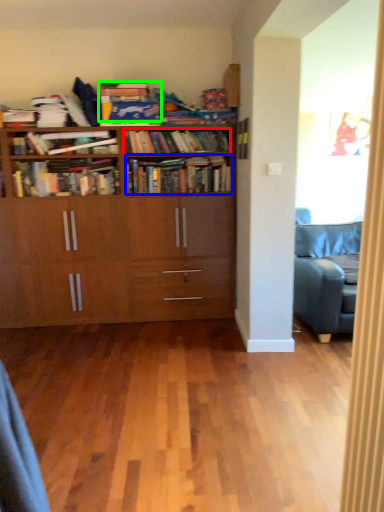
Question: Based on their relative distances, which object is nearer to book (highlighted by a red box)? Choose from book (highlighted by a blue box) and book (highlighted by a green box).

Choices:
 (A) book
 (B) book

Answer: (A)